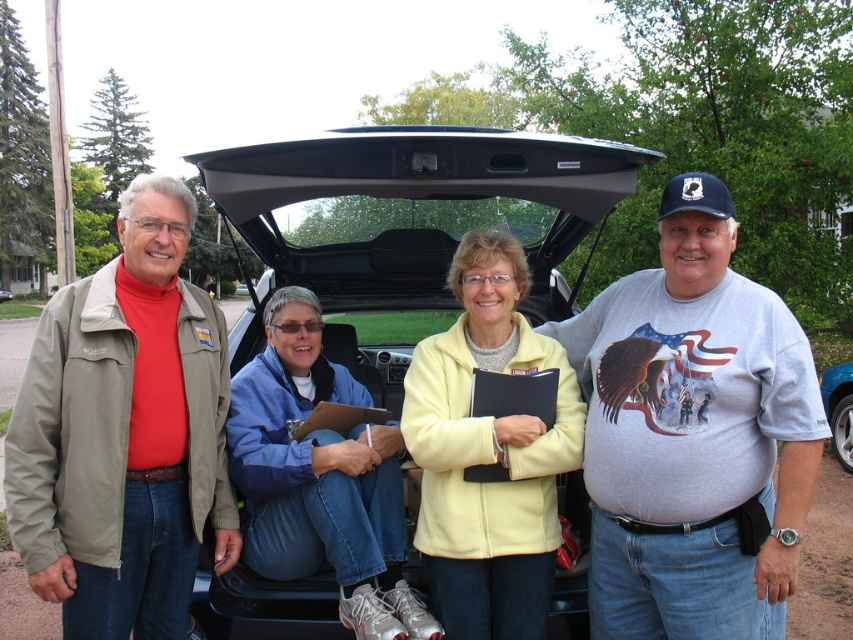
In the scene shown: You are trying to decide if the yellow fleece jacket at center can fit inside the black plastic car trunk at center. Based on their sizes, is it possible?

The black plastic car trunk at center might be wider than yellow fleece jacket at center, so there is a possibility that the yellow fleece jacket at center can fit inside the trunk.

You are standing at the point marked by the coordinate (693, 435) in the image. Looking around, you see a gray cotton tshirt at center. Which direction should you face to see the gray cotton tshirt at center?

You are already facing the gray cotton tshirt at center because the point marks its location.